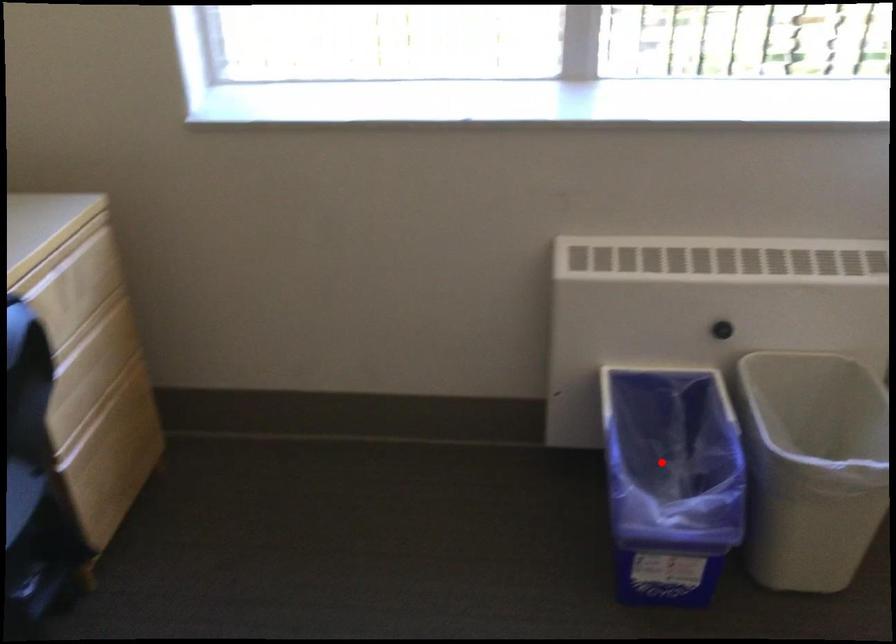
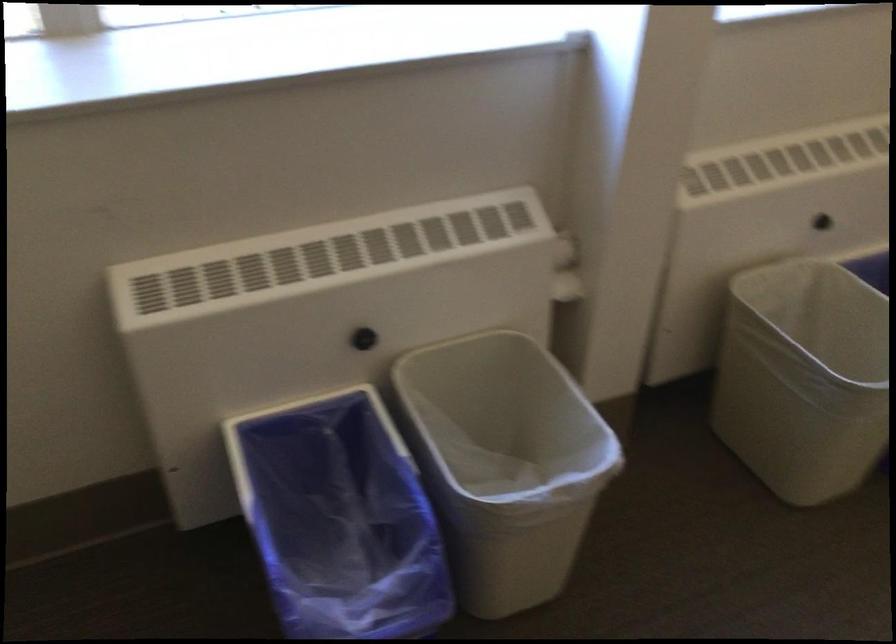
Question: I am providing you with two images of the same scene from different viewpoints. Image1 has a red point marked. In image2, the corresponding 3D location appears at what relative position? Reply with the corresponding letter.

Choices:
 (A) Closer
 (B) Farther

Answer: (A)